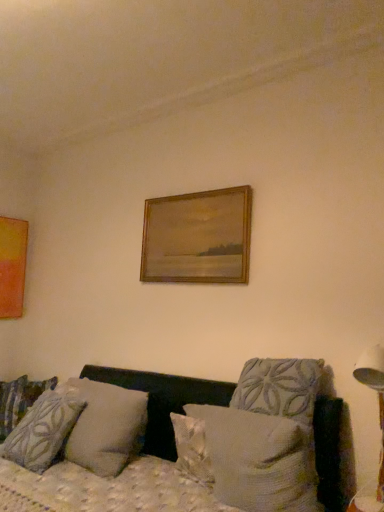
Question: Is textured gray pillow at lower left, the third pillow from the right, in front of or behind white plastic table lamp at right in the image?

Choices:
 (A) front
 (B) behind

Answer: (B)

Question: Considering the positions of textured gray pillow at lower left, which is counted as the third pillow, starting from the back, and white plastic table lamp at right in the image, is textured gray pillow at lower left, which is counted as the third pillow, starting from the back, wider or thinner than white plastic table lamp at right?

Choices:
 (A) wide
 (B) thin

Answer: (A)

Question: Which object is the farthest from the wooden frame at upper center, acting as the 2th picture frame starting from the back?

Choices:
 (A) textured beige pillow at center, which ranks as the 1th pillow in right-to-left order
 (B) patterned fabric pillow at left, which ranks as the 4th pillow in right-to-left order
 (C) textured gray pillow at center, the third pillow viewed from the left
 (D) matte orange picture frame at left, acting as the 2th picture frame starting from the front
 (E) textured gray pillow at lower left, the third pillow from the right

Answer: (D)

Question: Which object is positioned closest to the patterned fabric pillow at left, positioned as the 4th pillow in front-to-back order?

Choices:
 (A) textured gray pillow at center, the 2th pillow when ordered from back to front
 (B) matte orange picture frame at left, acting as the 2th picture frame starting from the front
 (C) textured fabric couch at lower center
 (D) wooden frame at upper center, acting as the 2th picture frame starting from the back
 (E) textured gray pillow at lower left, placed as the 2th pillow when sorted from left to right

Answer: (C)